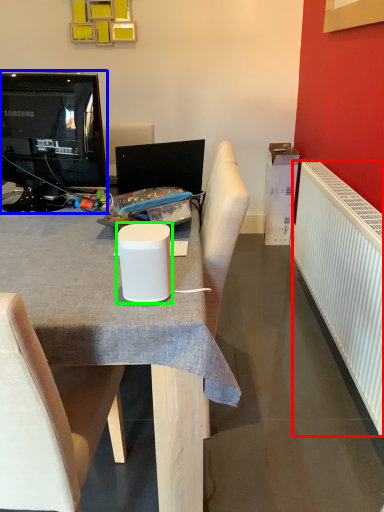
Question: Which object is the closest to the radiator (highlighted by a red box)? Choose among these: television (highlighted by a blue box) or paper cup (highlighted by a green box).

Choices:
 (A) television
 (B) paper cup

Answer: (B)